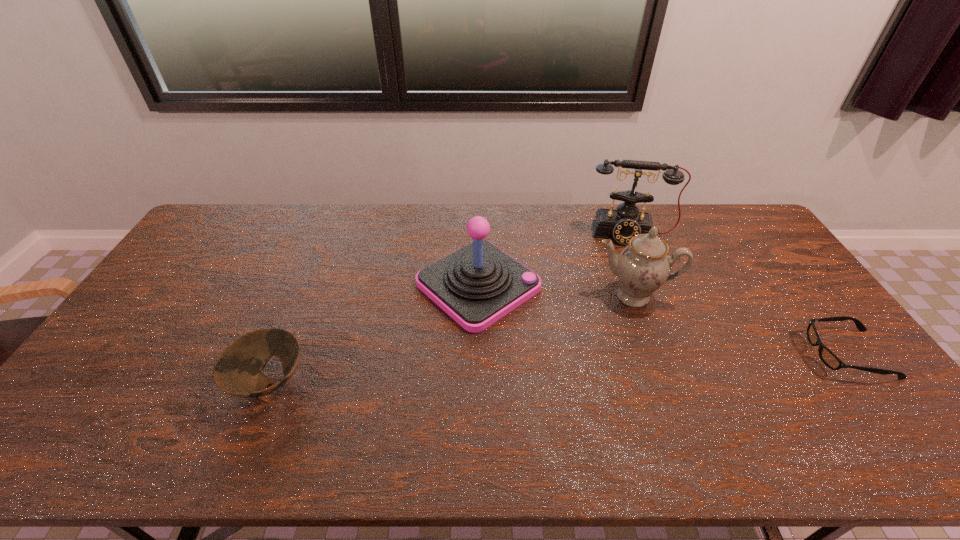
Where is `free location that satisfies the following two spatial constraints: 1. on the front side of the spectacles; 2. on the front-facing side of the chinaware`? This screenshot has width=960, height=540. free location that satisfies the following two spatial constraints: 1. on the front side of the spectacles; 2. on the front-facing side of the chinaware is located at coordinates (653, 354).

At what (x,y) coordinates should I click in order to perform the action: click on blank area in the image that satisfies the following two spatial constraints: 1. on the back side of the telephone; 2. on the right side of the chinaware. Please return your answer as a coordinate pair (x, y). Image resolution: width=960 pixels, height=540 pixels. Looking at the image, I should click on (611, 234).

Where is `free spot that satisfies the following two spatial constraints: 1. on the back side of the second shortest object; 2. on the right side of the joystick`? The image size is (960, 540). free spot that satisfies the following two spatial constraints: 1. on the back side of the second shortest object; 2. on the right side of the joystick is located at coordinates (309, 285).